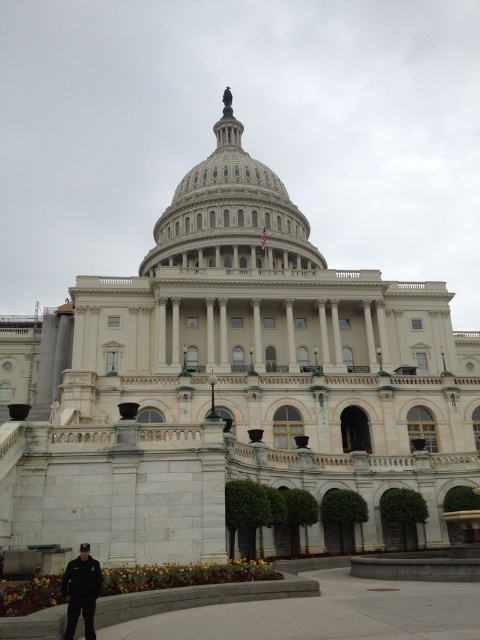
You are standing in front of the United States Capitol Building and want to take a photo of the white marble dome at center. If your camera has a maximum focus range of 100 meters, will you be able to capture the dome clearly?

The white marble dome at center is 112.64 meters away from viewer, which exceeds the camera maximum focus range of 100 meters. Therefore, you won not be able to capture the dome clearly.

You are standing in front of the United States Capitol Building and want to take a photo that includes both the white marble dome at center and the dark blue uniform at lower left. Which object should you focus on first to ensure both are in the frame?

You should focus on the white marble dome at center first because it is closer to you than the dark blue uniform at lower left, so adjusting the camera to include it will naturally capture the farther object as well.

You are standing in front of the United States Capitol Building and notice two points marked on the facade. The first point is at coordinates point (224, 156) and the second is at point (86, 600). Which of these points is closer to you?

Point (224, 156) is closer to you because it is further to the viewer than point (86, 600).